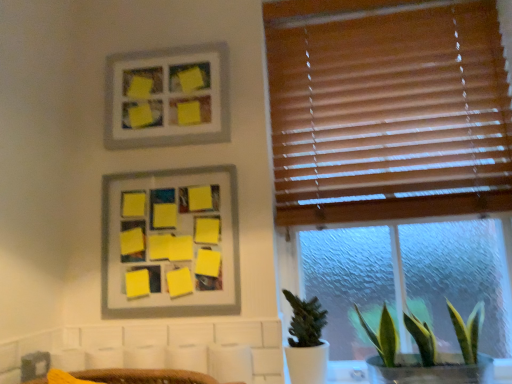
Question: Does green leafy plant at lower right, which ranks as the 1th houseplant in right-to-left order, have a larger size compared to yellow matte board at upper center, which appears as the 2th picture frame when viewed from the top?

Choices:
 (A) yes
 (B) no

Answer: (A)

Question: Considering the relative positions of green leafy plant at lower right, which ranks as the 1th houseplant in right-to-left order, and yellow matte board at upper center, which appears as the 2th picture frame when viewed from the top, in the image provided, is green leafy plant at lower right, which ranks as the 1th houseplant in right-to-left order, to the left of yellow matte board at upper center, which appears as the 2th picture frame when viewed from the top, from the viewer's perspective?

Choices:
 (A) no
 (B) yes

Answer: (A)

Question: Is yellow matte board at upper center, which is the first picture frame in bottom-to-top order, a part of green leafy plant at lower right, which ranks as the 1th houseplant in right-to-left order?

Choices:
 (A) no
 (B) yes

Answer: (A)

Question: Can you confirm if green leafy plant at lower right, which ranks as the 1th houseplant in right-to-left order, is wider than yellow matte board at upper center, which appears as the 2th picture frame when viewed from the top?

Choices:
 (A) no
 (B) yes

Answer: (B)

Question: Is yellow matte board at upper center, which appears as the 2th picture frame when viewed from the top, at the back of green leafy plant at lower right, which ranks as the 1th houseplant in right-to-left order?

Choices:
 (A) no
 (B) yes

Answer: (A)

Question: Relative to green leafy plant at lower right, which ranks as the 1th houseplant in right-to-left order, is green matte plant at lower right, which is the second houseplant in right-to-left order, in front or behind?

Choices:
 (A) front
 (B) behind

Answer: (B)

Question: Is point (305, 352) closer or farther from the camera than point (408, 370)?

Choices:
 (A) closer
 (B) farther

Answer: (B)

Question: In terms of size, does green matte plant at lower right, which appears as the first houseplant when viewed from the left, appear bigger or smaller than green leafy plant at lower right, which ranks as the 1th houseplant in right-to-left order?

Choices:
 (A) small
 (B) big

Answer: (A)

Question: Visually, is green matte plant at lower right, which is the second houseplant in right-to-left order, positioned to the left or to the right of green leafy plant at lower right, the second houseplant when ordered from left to right?

Choices:
 (A) left
 (B) right

Answer: (A)

Question: Considering the positions of point (218, 211) and point (128, 56), is point (218, 211) closer or farther from the camera than point (128, 56)?

Choices:
 (A) closer
 (B) farther

Answer: (A)

Question: In the image, is yellow matte board at upper center, which is the first picture frame in bottom-to-top order, positioned in front of or behind yellow matte picture frame at upper center, the first picture frame from the top?

Choices:
 (A) behind
 (B) front

Answer: (B)

Question: From a real-world perspective, is yellow matte board at upper center, which is the first picture frame in bottom-to-top order, positioned above or below yellow matte picture frame at upper center, the first picture frame from the top?

Choices:
 (A) below
 (B) above

Answer: (A)

Question: Considering the positions of yellow matte board at upper center, which is the first picture frame in bottom-to-top order, and yellow matte picture frame at upper center, which is the 2th picture frame from bottom to top, in the image, is yellow matte board at upper center, which is the first picture frame in bottom-to-top order, wider or thinner than yellow matte picture frame at upper center, which is the 2th picture frame from bottom to top,?

Choices:
 (A) thin
 (B) wide

Answer: (A)

Question: Is yellow matte picture frame at upper center, which is the 2th picture frame from bottom to top, bigger or smaller than yellow matte board at upper center, which appears as the 2th picture frame when viewed from the top?

Choices:
 (A) big
 (B) small

Answer: (B)

Question: Looking at their shapes, would you say yellow matte picture frame at upper center, the first picture frame from the top, is wider or thinner than yellow matte board at upper center, which is the first picture frame in bottom-to-top order?

Choices:
 (A) wide
 (B) thin

Answer: (A)